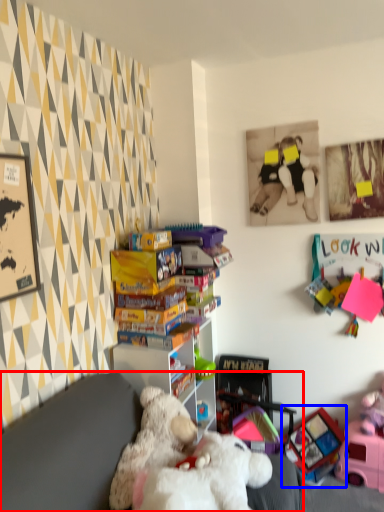
Question: Which object is further to the camera taking this photo, furniture (highlighted by a red box) or toy (highlighted by a blue box)?

Choices:
 (A) furniture
 (B) toy

Answer: (B)